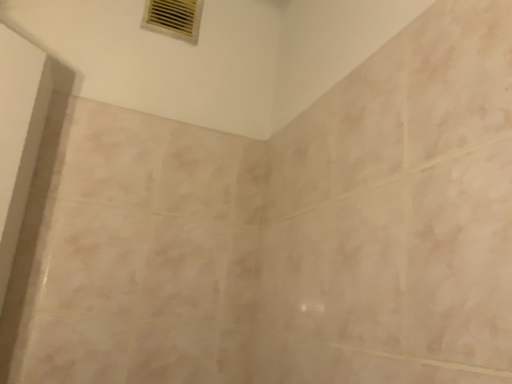
In order to face white textured vent at upper center, should I rotate leftwards or rightwards?

A 10.756 degree turn to the left will do.

The width and height of the screenshot is (512, 384). I want to click on white textured vent at upper center, so click(x=174, y=18).

Describe the element at coordinates (174, 18) in the screenshot. The height and width of the screenshot is (384, 512). I see `white textured vent at upper center` at that location.

Locate an element on the screen. The image size is (512, 384). white textured vent at upper center is located at coordinates (174, 18).